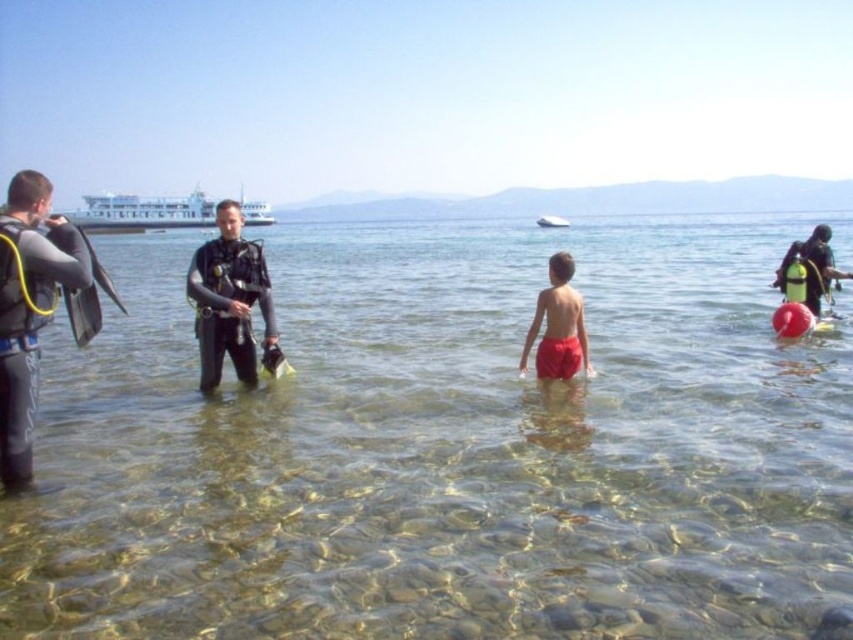
Does matte black wetsuit at left have a greater height compared to black matte scuba gear at center?

Yes.

Does point (28, 296) lie in front of point (201, 380)?

Yes, point (28, 296) is in front of point (201, 380).

Describe the element at coordinates (28, 308) in the screenshot. I see `matte black wetsuit at left` at that location.

This screenshot has width=853, height=640. Find the location of `matte black wetsuit at left`. matte black wetsuit at left is located at coordinates (28, 308).

Is point (256, 218) behind point (546, 225)?

Yes, it is behind point (546, 225).

Is white matte ferry at upper left to the right of white matte boat at upper center from the viewer's perspective?

No, white matte ferry at upper left is not to the right of white matte boat at upper center.

Which is in front, point (149, 216) or point (550, 216)?

Positioned in front is point (149, 216).

Identify the location of white matte ferry at upper left. This screenshot has width=853, height=640. (144, 211).

Can you confirm if red matte shorts at center is positioned to the right of white matte ferry at upper left?

Indeed, red matte shorts at center is positioned on the right side of white matte ferry at upper left.

Describe the element at coordinates (558, 324) in the screenshot. This screenshot has width=853, height=640. I see `red matte shorts at center` at that location.

Describe the element at coordinates (558, 324) in the screenshot. I see `red matte shorts at center` at that location.

This screenshot has width=853, height=640. I want to click on red matte shorts at center, so click(x=558, y=324).